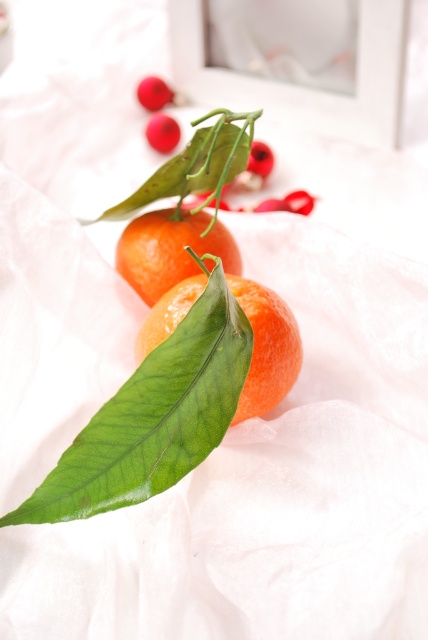
Question: Which object appears closest to the camera in this image?

Choices:
 (A) glossy orange at center
 (B) green glossy leaf at center
 (C) orange matte/crushed at center

Answer: (B)

Question: Which object is positioned farthest from the green glossy leaf at center?

Choices:
 (A) glossy orange at center
 (B) orange matte/crushed at center

Answer: (B)

Question: Does green glossy leaf at center appear on the right side of orange matte/crushed at center?

Choices:
 (A) no
 (B) yes

Answer: (A)

Question: Does green glossy leaf at center have a larger size compared to glossy orange at center?

Choices:
 (A) no
 (B) yes

Answer: (B)

Question: Is green glossy leaf at center closer to camera compared to glossy orange at center?

Choices:
 (A) no
 (B) yes

Answer: (B)

Question: Which point is farther to the camera?

Choices:
 (A) click(x=291, y=372)
 (B) click(x=196, y=220)
 (C) click(x=196, y=333)

Answer: (B)